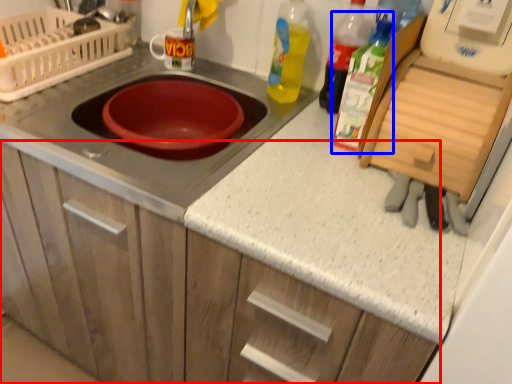
Question: Which object is further to the camera taking this photo, cabinetry (highlighted by a red box) or bottle (highlighted by a blue box)?

Choices:
 (A) cabinetry
 (B) bottle

Answer: (B)